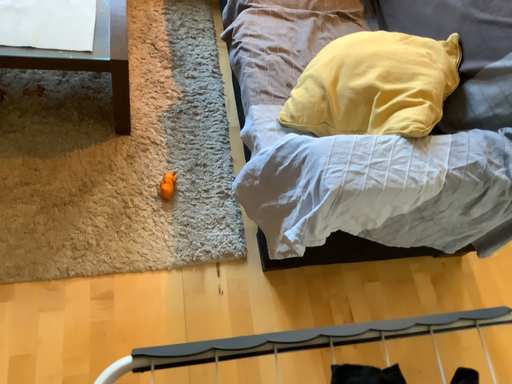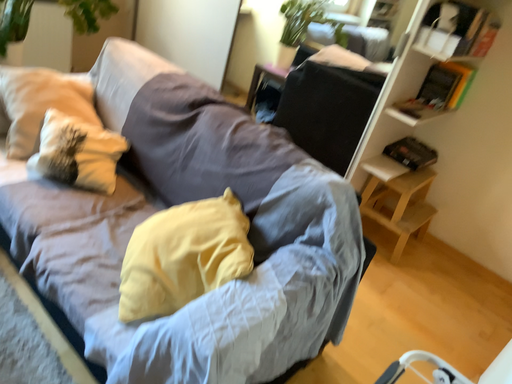
Question: How did the camera likely rotate when shooting the video?

Choices:
 (A) rotated right
 (B) rotated left

Answer: (A)